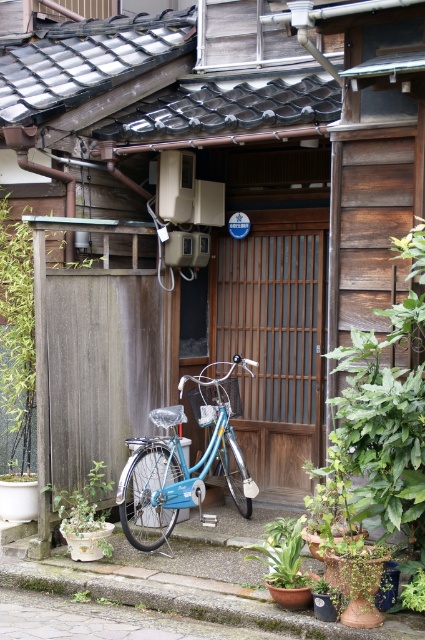
Question: Is green leafy plant at center to the right of green wood fence at left from the viewer's perspective?

Choices:
 (A) yes
 (B) no

Answer: (A)

Question: Which object is farther from the camera taking this photo?

Choices:
 (A) green leafy plant at center
 (B) green leafy plant at lower center
 (C) matte blue bicycle at lower left

Answer: (C)

Question: Among these points, which one is farthest from the camera?

Choices:
 (A) (11, 307)
 (B) (289, 550)
 (C) (204, 397)

Answer: (C)

Question: Can you confirm if green leafy plant at center is positioned to the left of green matte pot at lower left?

Choices:
 (A) yes
 (B) no

Answer: (B)

Question: Which of these objects is positioned farthest from the green matte pot at lower left?

Choices:
 (A) green leafy plant at center
 (B) matte blue bicycle at lower left
 (C) green wood fence at left

Answer: (A)

Question: Can you confirm if green leafy plant at center is positioned above green wood fence at left?

Choices:
 (A) no
 (B) yes

Answer: (A)